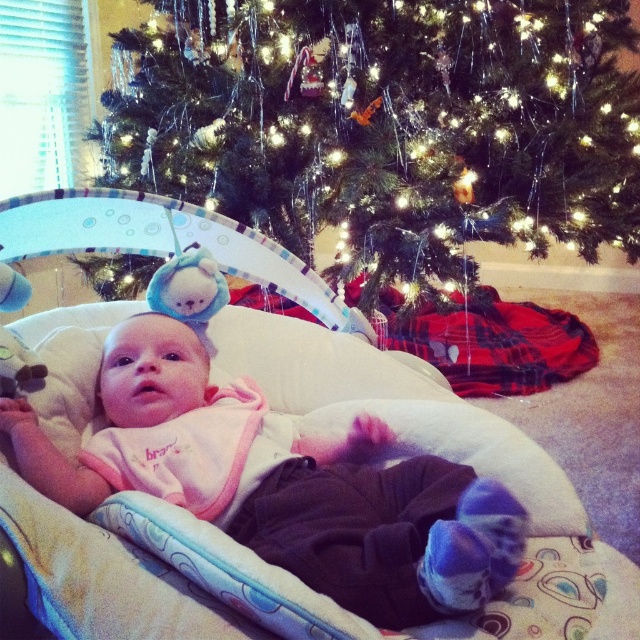
Question: Which object appears farthest from the camera in this image?

Choices:
 (A) pink fleece baby at center
 (B) green matte christmas tree at center

Answer: (B)

Question: Which of the following is the farthest from the observer?

Choices:
 (A) (445, 472)
 (B) (612, 8)

Answer: (B)

Question: Which object is farther from the camera taking this photo?

Choices:
 (A) green matte christmas tree at center
 (B) pink fleece baby at center

Answer: (A)

Question: Does green matte christmas tree at center appear over pink fleece baby at center?

Choices:
 (A) no
 (B) yes

Answer: (B)

Question: Can you confirm if green matte christmas tree at center is positioned to the left of pink fleece baby at center?

Choices:
 (A) yes
 (B) no

Answer: (B)

Question: Can you confirm if green matte christmas tree at center is positioned to the right of pink fleece baby at center?

Choices:
 (A) no
 (B) yes

Answer: (B)